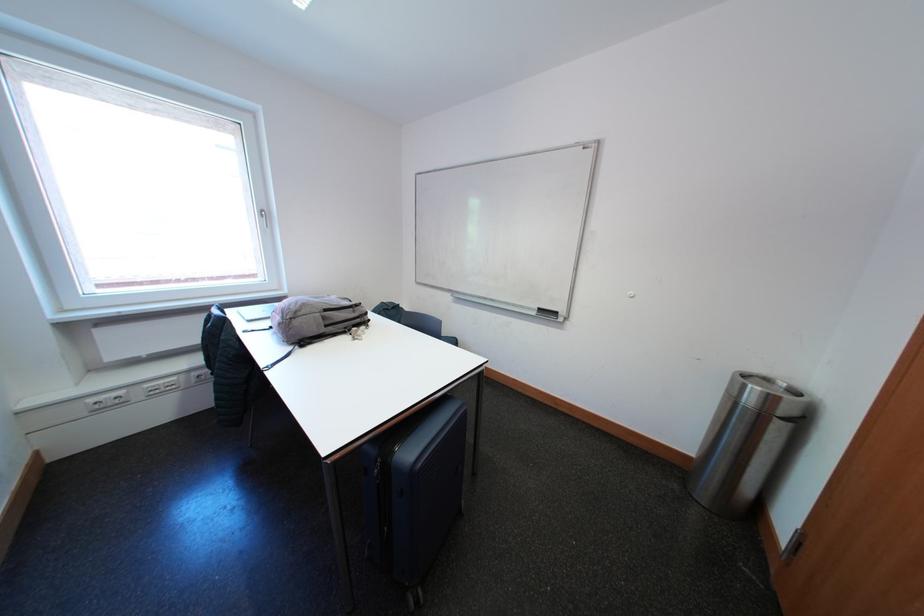
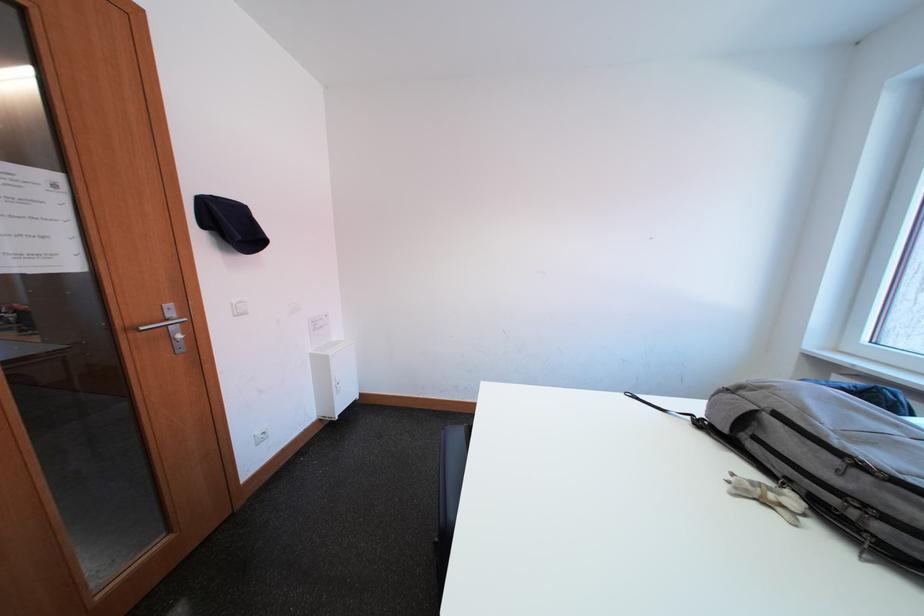
In the second image, find the point that corresponds to point 321,347 in the first image.

(719, 438)